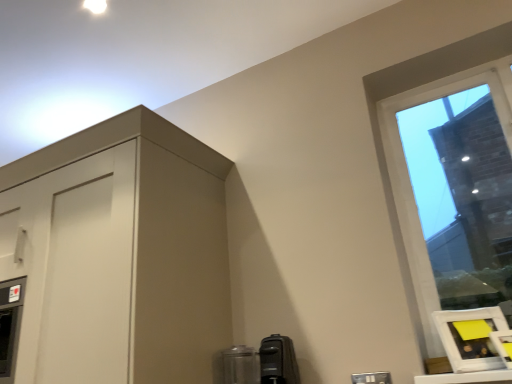
Question: Is black plastic coffee maker at lower center, the 2th appliance viewed from the left, bigger than matte white cabinet at upper left?

Choices:
 (A) no
 (B) yes

Answer: (A)

Question: From a real-world perspective, is black plastic coffee maker at lower center, the 2th appliance viewed from the left, on top of matte white cabinet at upper left?

Choices:
 (A) no
 (B) yes

Answer: (A)

Question: Is black plastic coffee maker at lower center, the 1th appliance viewed from the right, completely or partially outside of matte white cabinet at upper left?

Choices:
 (A) yes
 (B) no

Answer: (A)

Question: Would you say matte white cabinet at upper left is part of black plastic coffee maker at lower center, the 2th appliance viewed from the left,'s contents?

Choices:
 (A) yes
 (B) no

Answer: (B)

Question: Can you confirm if black plastic coffee maker at lower center, the 1th appliance viewed from the right, is smaller than matte white cabinet at upper left?

Choices:
 (A) yes
 (B) no

Answer: (A)

Question: Is clear glass window at upper right inside the boundaries of white matte picture frame at lower right, or outside?

Choices:
 (A) inside
 (B) outside

Answer: (B)

Question: Is clear glass window at upper right in front of or behind white matte picture frame at lower right in the image?

Choices:
 (A) front
 (B) behind

Answer: (B)

Question: From a real-world perspective, is clear glass window at upper right above or below white matte picture frame at lower right?

Choices:
 (A) below
 (B) above

Answer: (B)

Question: In terms of width, does clear glass window at upper right look wider or thinner when compared to white matte picture frame at lower right?

Choices:
 (A) wide
 (B) thin

Answer: (B)

Question: In terms of height, does white matte picture frame at lower right look taller or shorter compared to matte white cabinet at upper left?

Choices:
 (A) short
 (B) tall

Answer: (A)

Question: Is white matte picture frame at lower right in front of or behind matte white cabinet at upper left in the image?

Choices:
 (A) front
 (B) behind

Answer: (B)

Question: Based on their sizes in the image, would you say white matte picture frame at lower right is bigger or smaller than matte white cabinet at upper left?

Choices:
 (A) big
 (B) small

Answer: (B)

Question: From the image's perspective, is white matte picture frame at lower right above or below matte white cabinet at upper left?

Choices:
 (A) above
 (B) below

Answer: (B)

Question: Considering the positions of white matte picture frame at lower right and clear glass window at upper right in the image, is white matte picture frame at lower right taller or shorter than clear glass window at upper right?

Choices:
 (A) short
 (B) tall

Answer: (A)

Question: Based on their positions, is white matte picture frame at lower right located to the left or right of clear glass window at upper right?

Choices:
 (A) left
 (B) right

Answer: (A)